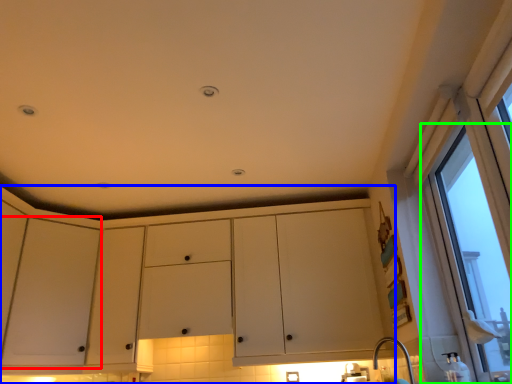
Question: Estimate the real-world distances between objects in this image. Which object is closer to screen door (highlighted by a red box), cabinetry (highlighted by a blue box) or window (highlighted by a green box)?

Choices:
 (A) cabinetry
 (B) window

Answer: (A)